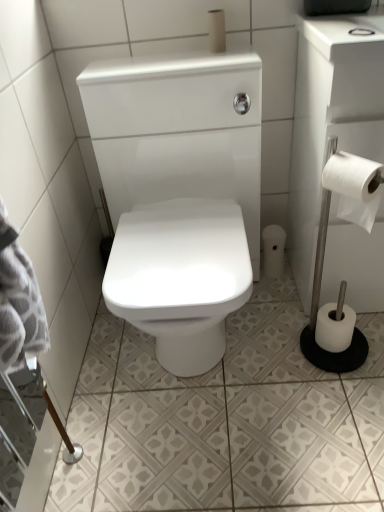
At what (x,y) coordinates should I click in order to perform the action: click on vacant space that is to the left of white matte toilet paper at upper center, placed as the 4th toilet paper when sorted from bottom to top. Please return your answer as a coordinate pair (x, y). Looking at the image, I should click on (158, 57).